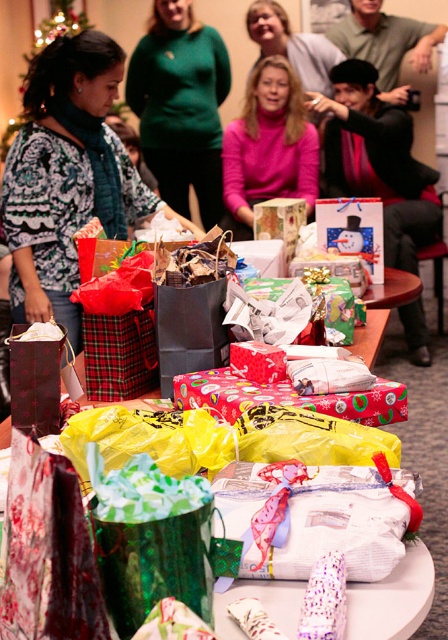
How much distance is there between wrapping paper gifts at center and sparkly pink wrapping paper at center?

wrapping paper gifts at center is 39.33 inches from sparkly pink wrapping paper at center.

Between wrapping paper gifts at center and sparkly pink wrapping paper at center, which one appears on the right side from the viewer's perspective?

wrapping paper gifts at center is more to the right.

Locate an element on the screen. wrapping paper gifts at center is located at coordinates (392, 289).

Between patterned fabric blouse at center and white paper wrapped at center, which one is positioned lower?

Positioned lower is white paper wrapped at center.

Who is taller, patterned fabric blouse at center or white paper wrapped at center?

Standing taller between the two is patterned fabric blouse at center.

Is point (76, 77) positioned in front of point (367, 540)?

No, (76, 77) is behind (367, 540).

Locate an element on the screen. This screenshot has height=640, width=448. patterned fabric blouse at center is located at coordinates (68, 176).

Is the position of white paper wrapped at center more distant than that of green sweater at upper center?

No, white paper wrapped at center is in front of green sweater at upper center.

Is point (257, 500) positioned before point (186, 72)?

Yes, it is in front of point (186, 72).

Identify the location of white paper wrapped at center. This screenshot has width=448, height=640. (317, 516).